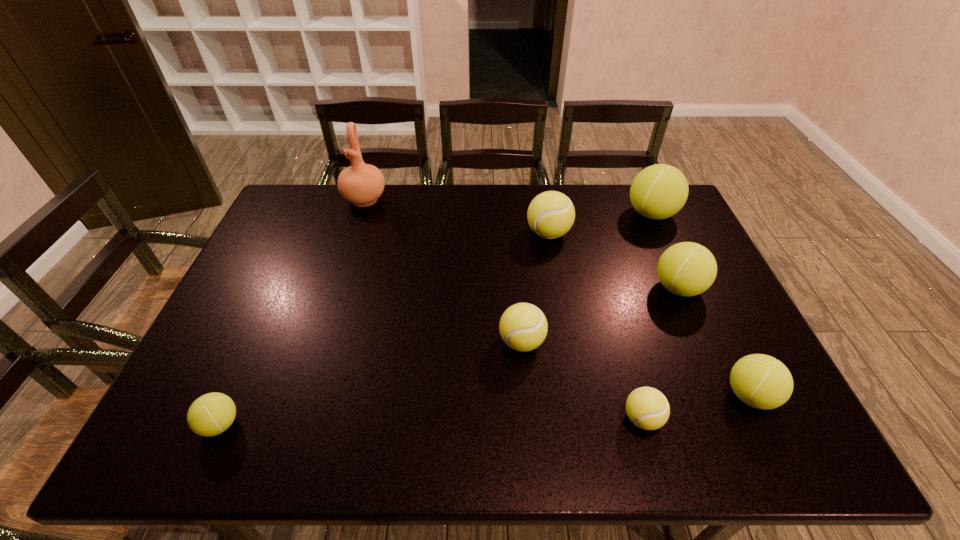
I want to click on free space between the nearest yellow tennis ball and the second biggest yellow tennis ball, so click(582, 380).

Image resolution: width=960 pixels, height=540 pixels. Find the location of `vacant space that's between the fourth nearest object and the tallest tennis ball`. vacant space that's between the fourth nearest object and the tallest tennis ball is located at coordinates (587, 278).

Locate an element on the screen. Image resolution: width=960 pixels, height=540 pixels. the fourth closest object to the tallest tennis ball is located at coordinates (760, 381).

Identify the location of the fifth closest object relative to the fourth nearest tennis ball. (659, 191).

Locate which tennis ball ranks sixth in proximity to the third biggest green tennis ball. Please provide its 2D coordinates. Your answer should be formatted as a tuple, i.e. [(x, y)], where the tuple contains the x and y coordinates of a point satisfying the conditions above.

[(211, 414)]

This screenshot has height=540, width=960. I want to click on tennis ball that stands as the second closest to the fourth tennis ball from left to right, so click(x=523, y=327).

Choose which green tennis ball is the third nearest neighbor to the second farthest green tennis ball. Please provide its 2D coordinates. Your answer should be formatted as a tuple, i.e. [(x, y)], where the tuple contains the x and y coordinates of a point satisfying the conditions above.

[(211, 414)]

Image resolution: width=960 pixels, height=540 pixels. Identify the location of green tennis ball that is the third closest one to the third nearest green tennis ball. (211, 414).

The image size is (960, 540). I want to click on yellow tennis ball that stands as the second closest to the second nearest yellow tennis ball, so click(x=551, y=214).

Point out which yellow tennis ball is positioned as the nearest to the pottery. Please provide its 2D coordinates. Your answer should be formatted as a tuple, i.e. [(x, y)], where the tuple contains the x and y coordinates of a point satisfying the conditions above.

[(551, 214)]